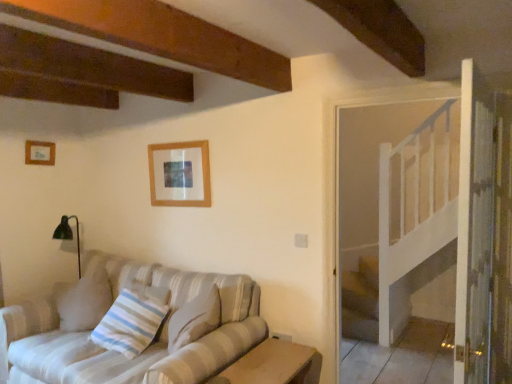
Question: From a real-world perspective, is wooden picture frame at upper center, arranged as the 1th picture frame when viewed from the right, below wooden table at lower center?

Choices:
 (A) yes
 (B) no

Answer: (B)

Question: Is wooden picture frame at upper center, positioned as the first picture frame in front-to-back order, with wooden table at lower center?

Choices:
 (A) no
 (B) yes

Answer: (A)

Question: Is wooden picture frame at upper center, positioned as the first picture frame in front-to-back order, wider than wooden table at lower center?

Choices:
 (A) no
 (B) yes

Answer: (A)

Question: From the image's perspective, is wooden picture frame at upper center, positioned as the first picture frame in front-to-back order, below wooden table at lower center?

Choices:
 (A) yes
 (B) no

Answer: (B)

Question: Is wooden picture frame at upper center, arranged as the 2th picture frame when viewed from the back, smaller than wooden table at lower center?

Choices:
 (A) no
 (B) yes

Answer: (B)

Question: Do you think wooden table at lower center is within striped fabric pillow at lower left, or outside of it?

Choices:
 (A) outside
 (B) inside

Answer: (A)

Question: From the image's perspective, is wooden table at lower center positioned above or below striped fabric pillow at lower left?

Choices:
 (A) above
 (B) below

Answer: (B)

Question: From a real-world perspective, is wooden table at lower center above or below striped fabric pillow at lower left?

Choices:
 (A) above
 (B) below

Answer: (B)

Question: Is point (287, 355) closer or farther from the camera than point (118, 309)?

Choices:
 (A) closer
 (B) farther

Answer: (A)

Question: In terms of size, does wooden picture frame at upper center, arranged as the 2th picture frame when viewed from the back, appear bigger or smaller than wooden picture frame at upper left, the first picture frame positioned from the back?

Choices:
 (A) big
 (B) small

Answer: (A)

Question: From a real-world perspective, is wooden picture frame at upper center, positioned as the first picture frame in front-to-back order, physically located above or below wooden picture frame at upper left, the second picture frame when ordered from right to left?

Choices:
 (A) above
 (B) below

Answer: (B)

Question: In the image, is wooden picture frame at upper center, positioned as the 2th picture frame in left-to-right order, positioned in front of or behind wooden picture frame at upper left, the second picture frame when ordered from right to left?

Choices:
 (A) front
 (B) behind

Answer: (A)

Question: In the image, is wooden picture frame at upper center, arranged as the 2th picture frame when viewed from the back, on the left side or the right side of wooden picture frame at upper left, the first picture frame positioned from the back?

Choices:
 (A) left
 (B) right

Answer: (B)

Question: From their relative heights in the image, would you say wooden picture frame at upper left, the 1th picture frame viewed from the left, is taller or shorter than wooden table at lower center?

Choices:
 (A) tall
 (B) short

Answer: (B)

Question: Relative to wooden table at lower center, is wooden picture frame at upper left, the 1th picture frame viewed from the left, in front or behind?

Choices:
 (A) front
 (B) behind

Answer: (B)